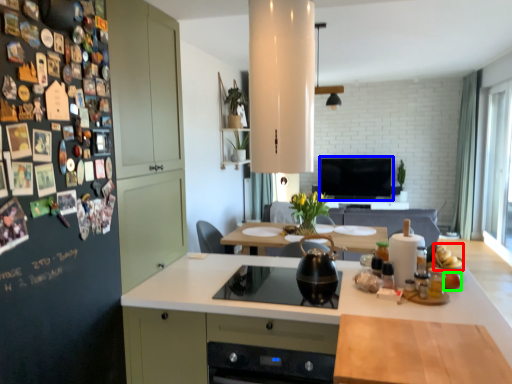
Question: Which object is positioned farthest from food (highlighted by a red box)? Select from television (highlighted by a blue box) and food (highlighted by a green box).

Choices:
 (A) television
 (B) food

Answer: (A)